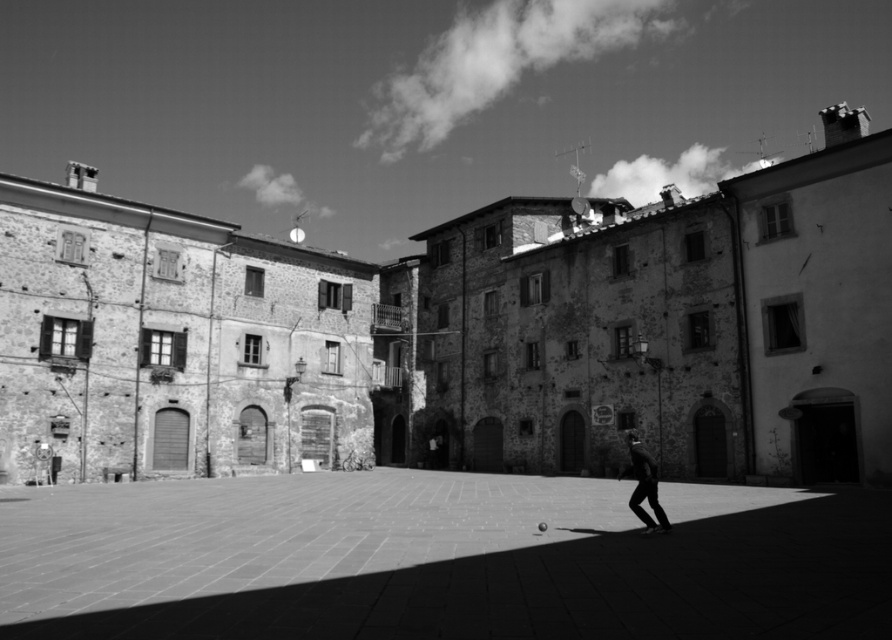
Question: Does smooth stone alley at center have a smaller size compared to dark fabric pants at lower right?

Choices:
 (A) no
 (B) yes

Answer: (A)

Question: Which of the following is the farthest from the observer?

Choices:
 (A) tap(640, 492)
 (B) tap(552, 515)

Answer: (B)

Question: Does smooth stone alley at center have a smaller size compared to dark fabric pants at lower right?

Choices:
 (A) yes
 (B) no

Answer: (B)

Question: Which point is closer to the camera?

Choices:
 (A) (624, 468)
 (B) (518, 604)

Answer: (B)

Question: Which object is farther from the camera taking this photo?

Choices:
 (A) smooth stone alley at center
 (B) dark fabric pants at lower right

Answer: (B)

Question: Can you confirm if smooth stone alley at center is bigger than dark fabric pants at lower right?

Choices:
 (A) no
 (B) yes

Answer: (B)